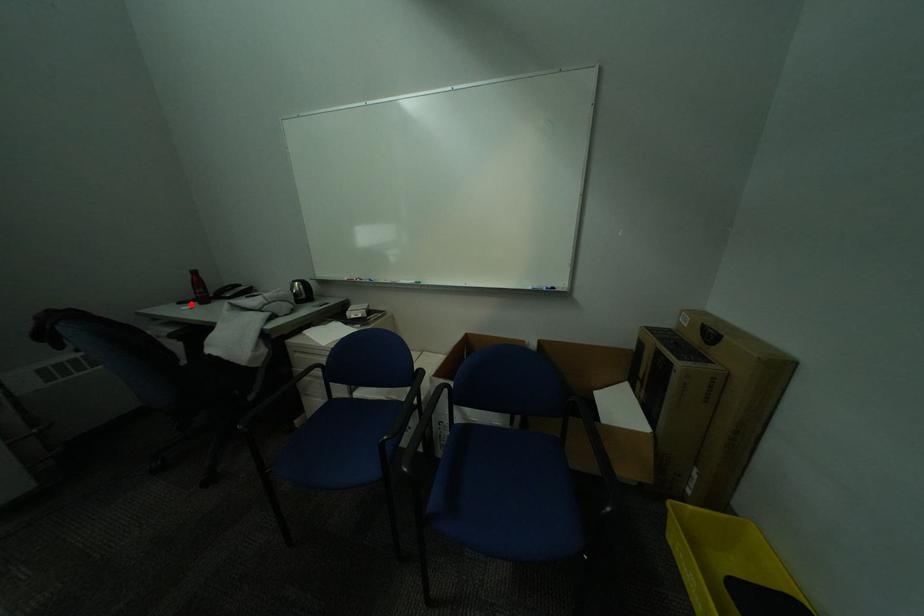
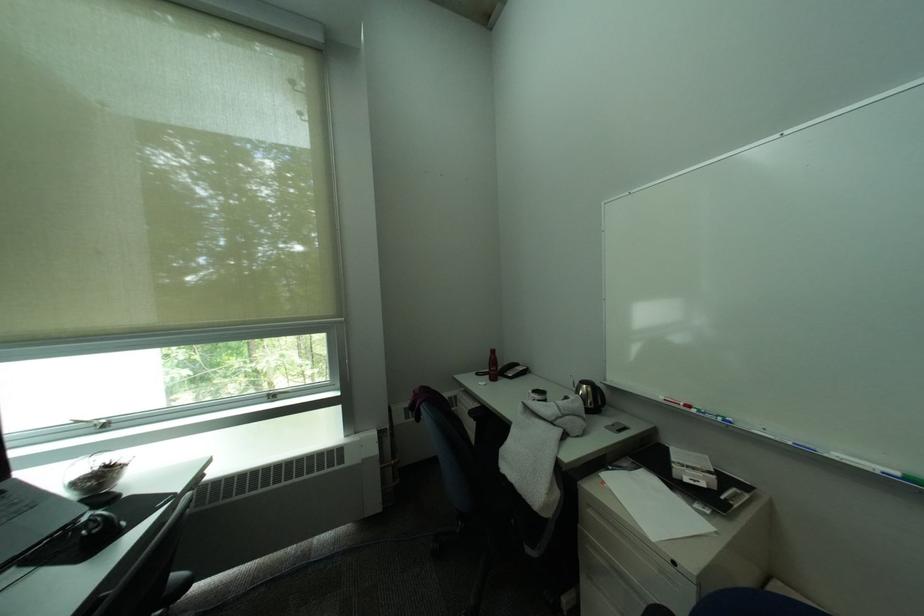
The point at the highlighted location is marked in the first image. Where is the corresponding point in the second image?

(488, 376)